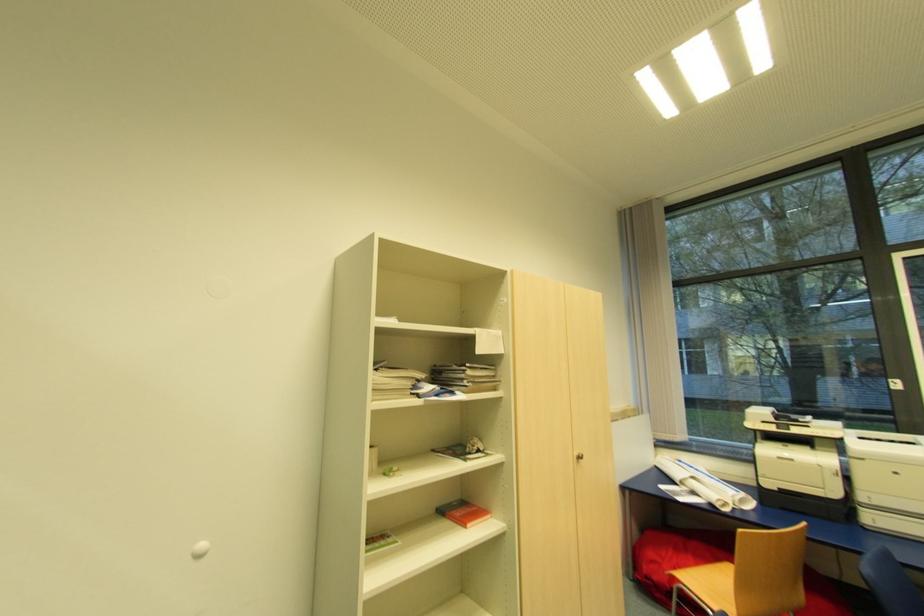
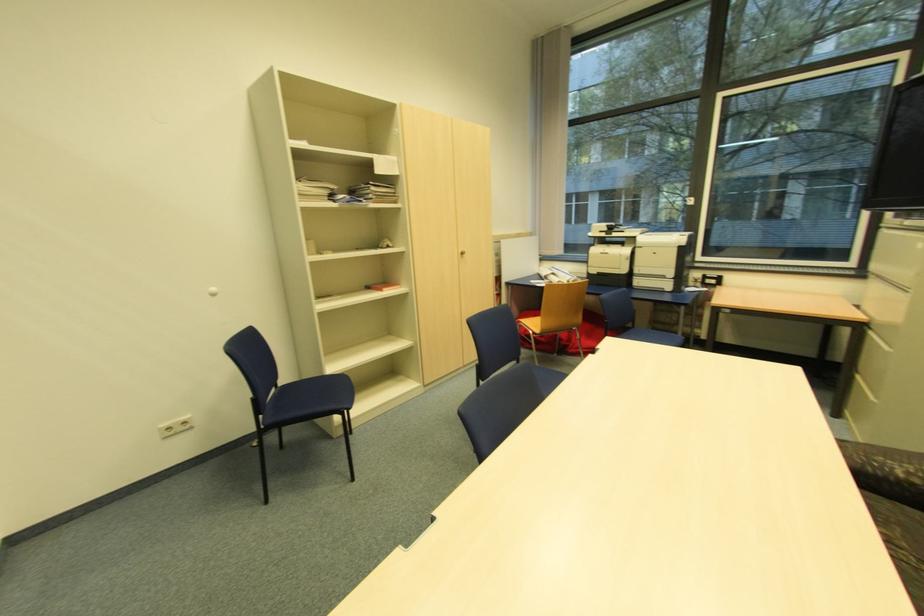
Find the pixel in the second image that matches (581,458) in the first image.

(466, 254)